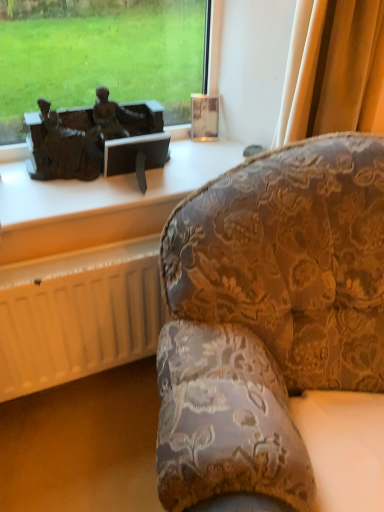
This screenshot has width=384, height=512. What do you see at coordinates (101, 202) in the screenshot?
I see `matte bronze sculpture at upper left` at bounding box center [101, 202].

Image resolution: width=384 pixels, height=512 pixels. What do you see at coordinates (267, 315) in the screenshot? I see `velvet floral-patterned couch at right` at bounding box center [267, 315].

Find the location of a particular element. This screenshot has height=512, width=384. white matte radiator at lower left is located at coordinates (78, 314).

Image resolution: width=384 pixels, height=512 pixels. What are the coordinates of `matte bronze sculpture at upper left` in the screenshot? It's located at (101, 202).

Which of these two, matte bronze sculpture at upper left or velvet floral-patterned couch at right, is bigger?

velvet floral-patterned couch at right.

Does point (79, 240) come farther from viewer compared to point (201, 266)?

Yes, point (79, 240) is behind point (201, 266).

Can you confirm if matte bronze sculpture at upper left is positioned to the right of velvet floral-patterned couch at right?

In fact, matte bronze sculpture at upper left is to the left of velvet floral-patterned couch at right.

Identify the location of furniture located underneath the bronze statue at left (from a real-world perspective). Image resolution: width=384 pixels, height=512 pixels. (101, 202).

Which point is more distant from viewer, (124, 215) or (50, 163)?

The point (50, 163) is farther from the camera.

Which object is positioned more to the left, matte bronze sculpture at upper left or bronze statue at left?

From the viewer's perspective, bronze statue at left appears more on the left side.

Based on the photo, based on their sizes in the image, would you say matte bronze sculpture at upper left is bigger or smaller than bronze statue at left?

→ In the image, matte bronze sculpture at upper left appears to be smaller than bronze statue at left.

Is bronze statue at left directly adjacent to matte bronze sculpture at upper left?

No.

Does bronze statue at left have a greater height compared to matte bronze sculpture at upper left?

Yes.

Visually, is bronze statue at left positioned to the left or to the right of matte bronze sculpture at upper left?

bronze statue at left is to the left of matte bronze sculpture at upper left.

Between bronze statue at left and matte bronze sculpture at upper left, which one has smaller size?

matte bronze sculpture at upper left.

Based on the photo, how distant is matte bronze sculpture at upper left from white matte radiator at lower left?

matte bronze sculpture at upper left is 8.13 inches away from white matte radiator at lower left.

From a real-world perspective, who is located higher, matte bronze sculpture at upper left or white matte radiator at lower left?

matte bronze sculpture at upper left is physically above.

Considering the sizes of matte bronze sculpture at upper left and white matte radiator at lower left in the image, is matte bronze sculpture at upper left wider or thinner than white matte radiator at lower left?

Considering their sizes, matte bronze sculpture at upper left looks broader than white matte radiator at lower left.

From the picture: Is matte bronze sculpture at upper left next to white matte radiator at lower left and touching it?

They are not placed beside each other.

How far apart are velvet floral-patterned couch at right and white matte radiator at lower left?

velvet floral-patterned couch at right is 44.44 centimeters from white matte radiator at lower left.

Considering the positions of point (296, 294) and point (105, 268), is point (296, 294) closer or farther from the camera than point (105, 268)?

Point (296, 294) is positioned closer to the camera compared to point (105, 268).

Is velvet floral-patterned couch at right positioned before white matte radiator at lower left?

Yes, the depth of velvet floral-patterned couch at right is less than that of white matte radiator at lower left.

From a real-world perspective, is velvet floral-patterned couch at right located beneath white matte radiator at lower left?

Incorrect, from a real-world perspective, velvet floral-patterned couch at right is higher than white matte radiator at lower left.

Between point (62, 141) and point (66, 345), which one is positioned in front?

The point (62, 141) is in front.

Is bronze statue at left aimed at white matte radiator at lower left?

No, bronze statue at left is not turned towards white matte radiator at lower left.

From the picture: Which of these two, bronze statue at left or white matte radiator at lower left, stands taller?

Standing taller between the two is white matte radiator at lower left.

From a real-world perspective, which is physically below, bronze statue at left or white matte radiator at lower left?

white matte radiator at lower left.

Is white matte radiator at lower left positioned beyond the bounds of bronze statue at left?

Yes, white matte radiator at lower left is located beyond the bounds of bronze statue at left.

The image size is (384, 512). What are the coordinates of `radiator on the left of bronze statue at left` in the screenshot? It's located at (78, 314).

Is bronze statue at left at the back of white matte radiator at lower left?

white matte radiator at lower left does not have its back to bronze statue at left.

How many degrees apart are the facing directions of white matte radiator at lower left and bronze statue at left?

The angle between the facing direction of white matte radiator at lower left and the facing direction of bronze statue at left is 0.415 degrees.

The width and height of the screenshot is (384, 512). Identify the location of furniture lying on the left of velvet floral-patterned couch at right. (101, 202).

Identify the location of antique above the matte bronze sculpture at upper left (from a real-world perspective). (86, 135).

Looking at the image, which one is located further to velvet floral-patterned couch at right, matte bronze sculpture at upper left or white matte radiator at lower left?

matte bronze sculpture at upper left is further to velvet floral-patterned couch at right.

When comparing their distances from bronze statue at left, does white matte radiator at lower left or velvet floral-patterned couch at right seem closer?

white matte radiator at lower left.

Which object lies further to the anchor point bronze statue at left, velvet floral-patterned couch at right or matte bronze sculpture at upper left?

velvet floral-patterned couch at right.

Estimate the real-world distances between objects in this image. Which object is closer to white matte radiator at lower left, bronze statue at left or velvet floral-patterned couch at right?

Among the two, bronze statue at left is located nearer to white matte radiator at lower left.

Based on their spatial positions, is velvet floral-patterned couch at right or bronze statue at left closer to matte bronze sculpture at upper left?

bronze statue at left is positioned closer to the anchor matte bronze sculpture at upper left.

Which object lies nearer to the anchor point velvet floral-patterned couch at right, bronze statue at left or white matte radiator at lower left?

white matte radiator at lower left.

Looking at the image, which one is located further to bronze statue at left, white matte radiator at lower left or matte bronze sculpture at upper left?

The object further to bronze statue at left is white matte radiator at lower left.

Which object lies nearer to the anchor point velvet floral-patterned couch at right, matte bronze sculpture at upper left or bronze statue at left?

Based on the image, matte bronze sculpture at upper left appears to be nearer to velvet floral-patterned couch at right.

You are a GUI agent. You are given a task and a screenshot of the screen. Output one action in this format:
    pyautogui.click(x=<x>, y=<y>)
    Task: Click on the radiator located between velvet floral-patterned couch at right and bronze statue at left in the depth direction
    The height and width of the screenshot is (512, 384).
    Given the screenshot: What is the action you would take?
    pyautogui.click(x=78, y=314)

This screenshot has width=384, height=512. I want to click on radiator between velvet floral-patterned couch at right and matte bronze sculpture at upper left along the z-axis, so click(78, 314).

The height and width of the screenshot is (512, 384). Identify the location of furniture positioned between velvet floral-patterned couch at right and bronze statue at left from near to far. (101, 202).

Find the location of `furniture between bronze statue at left and white matte radiator at lower left from top to bottom`. furniture between bronze statue at left and white matte radiator at lower left from top to bottom is located at coordinates (101, 202).